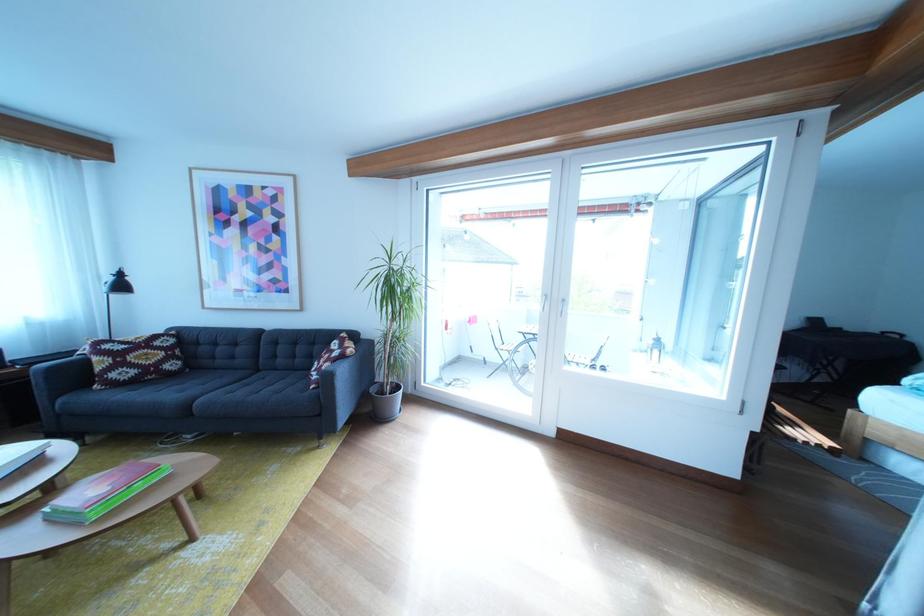
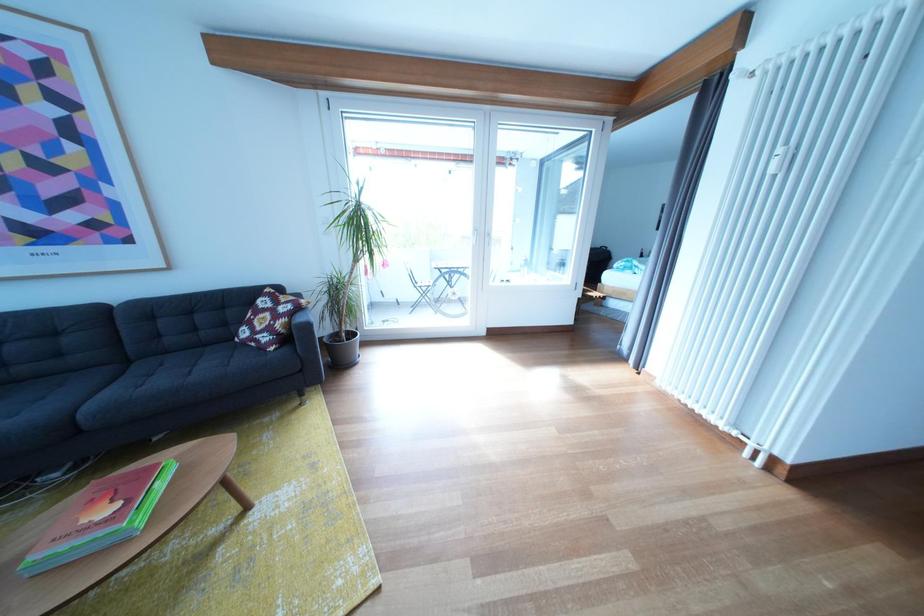
In the second image, find the point that corresponds to point 341,370 in the first image.

(296, 326)